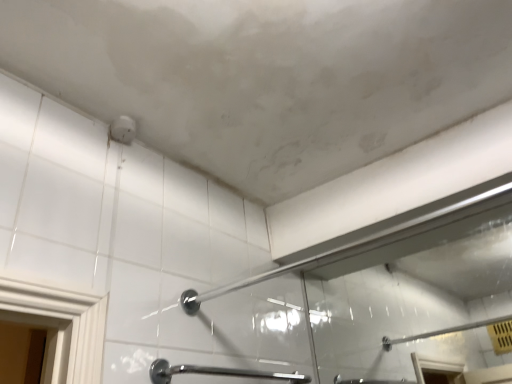
Question: In terms of height, does polished chrome grab bar at lower center look taller or shorter compared to white glossy shower at center?

Choices:
 (A) tall
 (B) short

Answer: (A)

Question: Looking at their shapes, would you say polished chrome grab bar at lower center is wider or thinner than white glossy shower at center?

Choices:
 (A) wide
 (B) thin

Answer: (A)

Question: Is polished chrome grab bar at lower center bigger or smaller than white glossy shower at center?

Choices:
 (A) small
 (B) big

Answer: (A)

Question: From the image's perspective, is white glossy shower at center positioned above or below polished chrome grab bar at lower center?

Choices:
 (A) below
 (B) above

Answer: (B)

Question: Relative to polished chrome grab bar at lower center, is white glossy shower at center in front or behind?

Choices:
 (A) behind
 (B) front

Answer: (B)

Question: Is white glossy shower at center inside or outside of polished chrome grab bar at lower center?

Choices:
 (A) inside
 (B) outside

Answer: (B)

Question: From a real-world perspective, is white glossy shower at center physically located above or below polished chrome grab bar at lower center?

Choices:
 (A) above
 (B) below

Answer: (A)